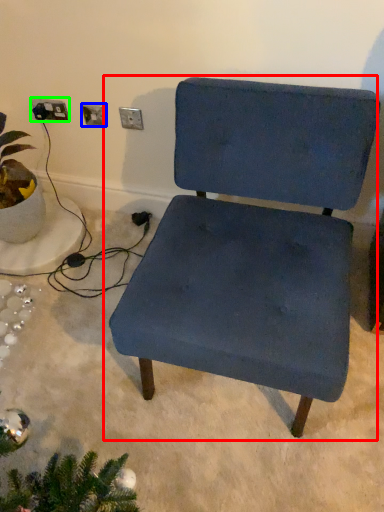
Question: Which is nearer to the chair (highlighted by a red box)? electric outlet (highlighted by a blue box) or electric outlet (highlighted by a green box).

Choices:
 (A) electric outlet
 (B) electric outlet

Answer: (A)